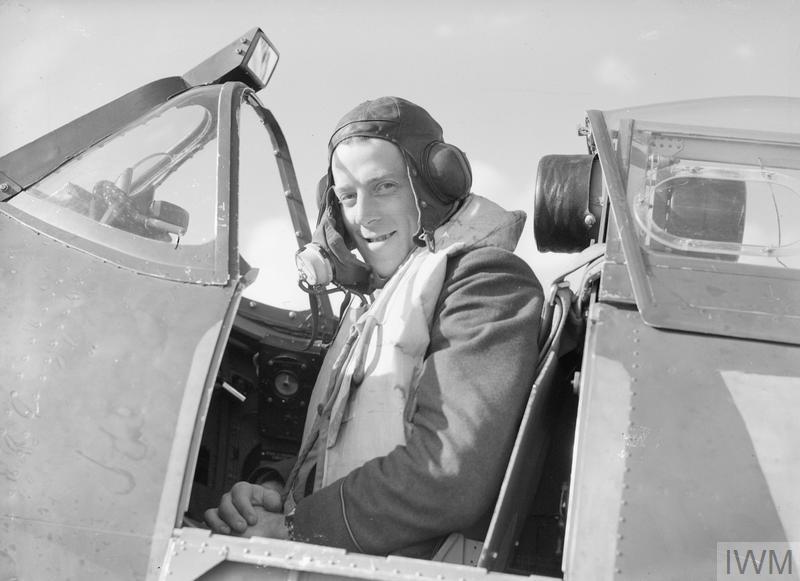
Identify the location of seat. The image size is (800, 581). (536, 412).